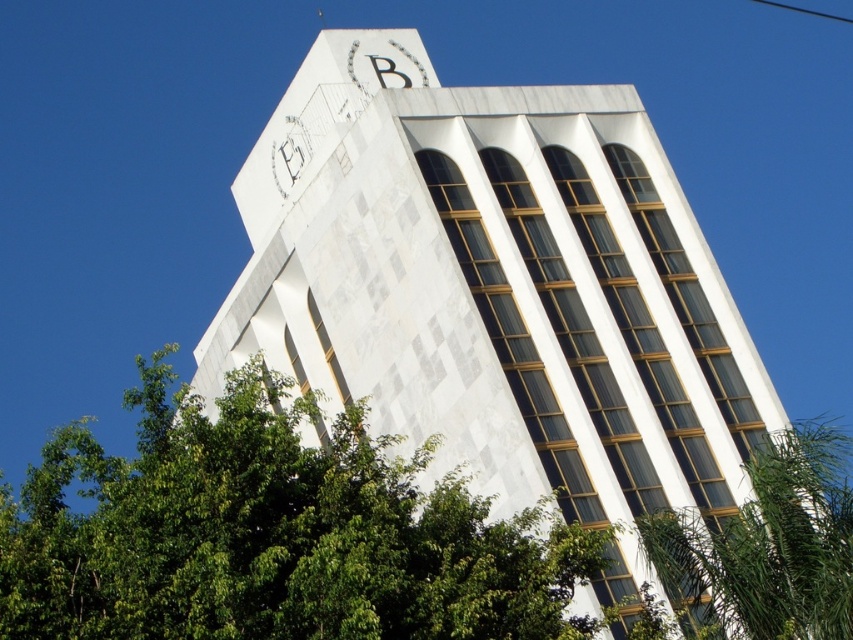
You are an architect analyzing the building design. You need to compare the widths of the white marble tower at center and the green leafy tree at lower right. Which one is wider?

The green leafy tree at lower right is wider than the white marble tower at center.

You are standing at the base of the tall modern building and want to take a photo of the green leafy tree at lower left. If your camera has a maximum zoom range of 100 feet, will you be able to capture the tree clearly without moving closer?

The green leafy tree at lower left is 76.79 feet away from the viewer. Since the camera can zoom up to 100 feet, you can capture the tree clearly without moving closer.